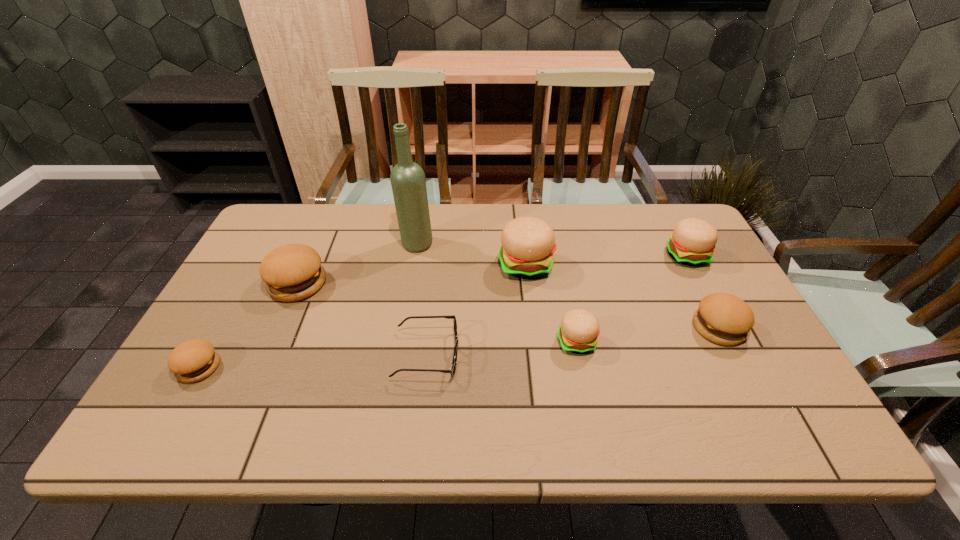
Locate which object ranks sixth in proximity to the shortest object. Please provide its 2D coordinates. Your answer should be formatted as a tuple, i.e. [(x, y)], where the tuple contains the x and y coordinates of a point satisfying the conditions above.

[(722, 318)]

Select which hamburger appears as the sixth closest to the wine bottle. Please provide its 2D coordinates. Your answer should be formatted as a tuple, i.e. [(x, y)], where the tuple contains the x and y coordinates of a point satisfying the conditions above.

[(722, 318)]

Find the location of a particular element. the closest hamburger to the rightmost brown hamburger is located at coordinates (693, 241).

Choose which beige hamburger is the second nearest neighbor to the green wine bottle. Please provide its 2D coordinates. Your answer should be formatted as a tuple, i.e. [(x, y)], where the tuple contains the x and y coordinates of a point satisfying the conditions above.

[(579, 329)]

I want to click on beige hamburger that is the closest to the tallest object, so coord(528,243).

You are a GUI agent. You are given a task and a screenshot of the screen. Output one action in this format:
    pyautogui.click(x=<x>, y=<y>)
    Task: Click on the second closest brown hamburger to the leftmost brown hamburger
    Image resolution: width=960 pixels, height=540 pixels.
    Given the screenshot: What is the action you would take?
    [x=722, y=318]

You are a GUI agent. You are given a task and a screenshot of the screen. Output one action in this format:
    pyautogui.click(x=<x>, y=<y>)
    Task: Click on the brown hamburger that is the second closest one to the leftmost hamburger
    The image size is (960, 540).
    Given the screenshot: What is the action you would take?
    pyautogui.click(x=722, y=318)

At what (x,y) coordinates should I click in order to perform the action: click on free spot that satisfies the following two spatial constraints: 1. on the front side of the tallest hamburger; 2. on the front-facing side of the spectacles. Please return your answer as a coordinate pair (x, y). The image size is (960, 540). Looking at the image, I should click on (537, 355).

You are a GUI agent. You are given a task and a screenshot of the screen. Output one action in this format:
    pyautogui.click(x=<x>, y=<y>)
    Task: Click on the free space that satisfies the following two spatial constraints: 1. on the front side of the rightmost brown hamburger; 2. on the right side of the farthest brown hamburger
    
    Given the screenshot: What is the action you would take?
    pyautogui.click(x=278, y=328)

Find the location of a particular element. free space that satisfies the following two spatial constraints: 1. on the back side of the tallest hamburger; 2. on the right side of the smallest brown hamburger is located at coordinates (256, 265).